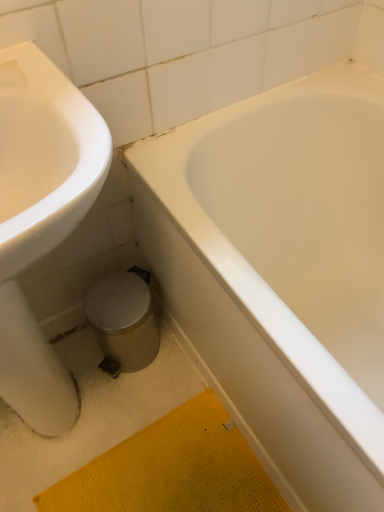
Question: Is white glossy bathtub at center outside white glossy sink at left?

Choices:
 (A) yes
 (B) no

Answer: (A)

Question: From a real-world perspective, is white glossy bathtub at center over white glossy sink at left?

Choices:
 (A) yes
 (B) no

Answer: (B)

Question: Does white glossy bathtub at center have a lesser height compared to white glossy sink at left?

Choices:
 (A) no
 (B) yes

Answer: (B)

Question: Is white glossy bathtub at center at the left side of white glossy sink at left?

Choices:
 (A) yes
 (B) no

Answer: (B)

Question: Does white glossy bathtub at center have a smaller size compared to white glossy sink at left?

Choices:
 (A) yes
 (B) no

Answer: (B)

Question: Does white glossy bathtub at center have a larger size compared to white glossy sink at left?

Choices:
 (A) no
 (B) yes

Answer: (B)

Question: Does yellow textured bath mat at lower center have a lesser width compared to white glossy bathtub at center?

Choices:
 (A) yes
 (B) no

Answer: (A)

Question: Is yellow textured bath mat at lower center looking in the opposite direction of white glossy bathtub at center?

Choices:
 (A) no
 (B) yes

Answer: (B)

Question: Is the depth of yellow textured bath mat at lower center less than that of white glossy bathtub at center?

Choices:
 (A) no
 (B) yes

Answer: (A)

Question: Is yellow textured bath mat at lower center to the right of white glossy bathtub at center from the viewer's perspective?

Choices:
 (A) yes
 (B) no

Answer: (B)

Question: Is yellow textured bath mat at lower center facing towards white glossy bathtub at center?

Choices:
 (A) no
 (B) yes

Answer: (A)

Question: Are yellow textured bath mat at lower center and white glossy bathtub at center making contact?

Choices:
 (A) yes
 (B) no

Answer: (B)

Question: Is white glossy bathtub at center turned away from yellow textured bath mat at lower center?

Choices:
 (A) no
 (B) yes

Answer: (A)